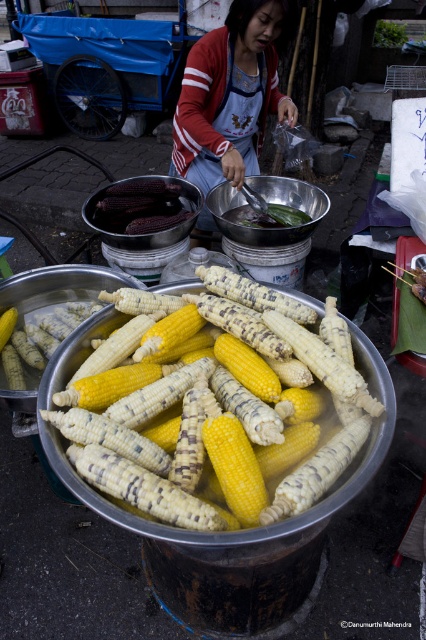
Question: Which is nearer to the purple matte corn at center?

Choices:
 (A) red and white striped sweater at center
 (B) yellow matte corn at center

Answer: (A)

Question: Is red and white striped sweater at center smaller than purple matte corn at center?

Choices:
 (A) no
 (B) yes

Answer: (A)

Question: Does red and white striped sweater at center appear on the right side of purple matte corn at center?

Choices:
 (A) yes
 (B) no

Answer: (A)

Question: Considering the real-world distances, which object is closest to the yellow matte corn at center?

Choices:
 (A) red and white striped sweater at center
 (B) purple matte corn at center

Answer: (B)

Question: Which point is closer to the camera?

Choices:
 (A) yellow matte corn at center
 (B) red and white striped sweater at center
 (C) purple matte corn at center

Answer: (A)

Question: From the image, what is the correct spatial relationship of yellow matte corn at center in relation to purple matte corn at center?

Choices:
 (A) left
 (B) right

Answer: (B)